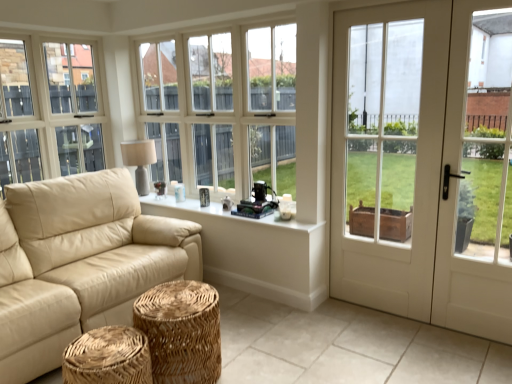
Describe the element at coordinates (425, 163) in the screenshot. I see `white glossy door at right` at that location.

What is the approximate width of white matte window sill at center, placed as the 1th window sill when sorted from bottom to top?

0.73 inches.

Locate an element on the screen. white painted wood at center, acting as the 1th window sill starting from the top is located at coordinates pos(216,213).

The image size is (512, 384). I want to click on white glossy door at right, so click(x=425, y=163).

Is there a large distance between woven natural stool at lower center, which ranks as the 2th stool in back-to-front order, and beige leather couch at left?

No, woven natural stool at lower center, which ranks as the 2th stool in back-to-front order, is not far from beige leather couch at left.

Considering the positions of objects woven natural stool at lower center, the first stool viewed from the front, and beige leather couch at left in the image provided, who is behind, woven natural stool at lower center, the first stool viewed from the front, or beige leather couch at left?

beige leather couch at left is more distant.

How many degrees apart are the facing directions of woven natural stool at lower center, which ranks as the 2th stool in back-to-front order, and beige leather couch at left?

1.86 degrees separate the facing orientations of woven natural stool at lower center, which ranks as the 2th stool in back-to-front order, and beige leather couch at left.

Is woven natural stool at lower center, the first stool viewed from the front, outside of beige leather couch at left?

Yes, woven natural stool at lower center, the first stool viewed from the front, is outside of beige leather couch at left.

Are woven natural stool at center, placed as the second stool when sorted from front to back, and woven natural stool at lower center, which ranks as the 2th stool in back-to-front order, located far from each other?

No, woven natural stool at center, placed as the second stool when sorted from front to back, is not far from woven natural stool at lower center, which ranks as the 2th stool in back-to-front order.

Which of these two, woven natural stool at center, placed as the second stool when sorted from front to back, or woven natural stool at lower center, which ranks as the 2th stool in back-to-front order, is bigger?

With larger size is woven natural stool at center, placed as the second stool when sorted from front to back.

Is woven natural stool at center, which is the first stool in back-to-front order, looking in the opposite direction of woven natural stool at lower center, which ranks as the 2th stool in back-to-front order?

woven natural stool at center, which is the first stool in back-to-front order, does not have its back to woven natural stool at lower center, which ranks as the 2th stool in back-to-front order.

Is point (151, 339) closer to camera compared to point (132, 378)?

That is False.

Between point (489, 81) and point (152, 380), which one is positioned behind?

The point (489, 81) is farther.

Is white glass door at right placed right next to woven natural stool at lower center, the first stool viewed from the front?

No, white glass door at right is not touching woven natural stool at lower center, the first stool viewed from the front.

Is white glass door at right thinner than woven natural stool at lower center, the first stool viewed from the front?

Correct, the width of white glass door at right is less than that of woven natural stool at lower center, the first stool viewed from the front.

Are matte beige lampshade at upper left and white glossy door at right located far from each other?

matte beige lampshade at upper left is positioned a significant distance from white glossy door at right.

From their relative heights in the image, would you say matte beige lampshade at upper left is taller or shorter than white glossy door at right?

Clearly, matte beige lampshade at upper left is shorter compared to white glossy door at right.

Is matte beige lampshade at upper left surrounding white glossy door at right?

Definitely not — white glossy door at right is not inside matte beige lampshade at upper left.

Is matte beige lampshade at upper left oriented towards white glossy door at right?

Yes, matte beige lampshade at upper left faces towards white glossy door at right.

Consider the image. From the image's perspective, is white wood window at center above or below white glossy door at right?

From the image's perspective, white wood window at center appears above white glossy door at right.

Which object is closer to the camera taking this photo, white wood window at center or white glossy door at right?

white glossy door at right is in front.

Is white wood window at center turned away from white glossy door at right?

No, white wood window at center's orientation is not away from white glossy door at right.

Is white painted wood at center, acting as the 1th window sill starting from the top, far away from white glossy door at right?

Indeed, white painted wood at center, acting as the 1th window sill starting from the top, is not near white glossy door at right.

From the image's perspective, between white painted wood at center, acting as the 1th window sill starting from the top, and white glossy door at right, which one is located above?

white glossy door at right appears higher in the image.

Is white painted wood at center, acting as the second window sill starting from the bottom, taller than white glossy door at right?

In fact, white painted wood at center, acting as the second window sill starting from the bottom, may be shorter than white glossy door at right.

In terms of width, does white painted wood at center, acting as the 1th window sill starting from the top, look wider or thinner when compared to white glossy door at right?

In the image, white painted wood at center, acting as the 1th window sill starting from the top, appears to be wider than white glossy door at right.

Considering the positions of objects woven natural stool at center, placed as the second stool when sorted from front to back, and white wood window at center in the image provided, who is more to the left, woven natural stool at center, placed as the second stool when sorted from front to back, or white wood window at center?

Positioned to the left is white wood window at center.

Does woven natural stool at center, placed as the second stool when sorted from front to back, have a lesser width compared to white wood window at center?

No, woven natural stool at center, placed as the second stool when sorted from front to back, is not thinner than white wood window at center.

From a real-world perspective, relative to white wood window at center, is woven natural stool at center, placed as the second stool when sorted from front to back, vertically above or below?

Clearly, from a real-world perspective, woven natural stool at center, placed as the second stool when sorted from front to back, is below white wood window at center.

From a real-world perspective, count 2nd stools downward from the beige leather couch at left and point to it. Please provide its 2D coordinates.

[(108, 357)]

At what (x,y) coordinates should I click in order to perform the action: click on stool lying above the woven natural stool at lower center, the first stool viewed from the front (from the image's perspective). Please return your answer as a coordinate pair (x, y). Looking at the image, I should click on (181, 331).

From the image, which object appears to be farther from beige leather couch at left, woven natural stool at center, placed as the second stool when sorted from front to back, or matte beige lampshade at upper left?

The object further to beige leather couch at left is matte beige lampshade at upper left.

Estimate the real-world distances between objects in this image. Which object is closer to beige leather couch at left, woven natural stool at center, placed as the second stool when sorted from front to back, or white glossy door at right?

Based on the image, woven natural stool at center, placed as the second stool when sorted from front to back, appears to be nearer to beige leather couch at left.

Looking at the image, which one is located further to white matte window sill at center, placed as the 1th window sill when sorted from bottom to top, white painted wood at center, acting as the second window sill starting from the bottom, or woven natural stool at center, which is the first stool in back-to-front order?

woven natural stool at center, which is the first stool in back-to-front order, is further to white matte window sill at center, placed as the 1th window sill when sorted from bottom to top.

Which object lies nearer to the anchor point white glass door at right, white matte window sill at center, placed as the 1th window sill when sorted from bottom to top, or white painted wood at center, acting as the second window sill starting from the bottom?

white matte window sill at center, placed as the 1th window sill when sorted from bottom to top, is closer to white glass door at right.

Which object lies further to the anchor point matte beige lampshade at upper left, white glass door at right or beige leather couch at left?

white glass door at right is positioned further to the anchor matte beige lampshade at upper left.

Considering their positions, is white wood window at center positioned closer to woven natural stool at center, placed as the second stool when sorted from front to back, than white glossy door at right?

white glossy door at right lies closer to woven natural stool at center, placed as the second stool when sorted from front to back, than the other object.

From the image, which object appears to be nearer to matte beige lampshade at upper left, woven natural stool at center, which is the first stool in back-to-front order, or beige leather couch at left?

The object closer to matte beige lampshade at upper left is beige leather couch at left.

From the image, which object appears to be farther from woven natural stool at center, placed as the second stool when sorted from front to back, beige leather couch at left or white painted wood at center, acting as the 1th window sill starting from the top?

The object further to woven natural stool at center, placed as the second stool when sorted from front to back, is white painted wood at center, acting as the 1th window sill starting from the top.

Identify the location of stool situated between beige leather couch at left and woven natural stool at center, placed as the second stool when sorted from front to back, from left to right. (108, 357).

Locate an element on the screen. The image size is (512, 384). window sill between woven natural stool at center, placed as the second stool when sorted from front to back, and white matte window sill at center, acting as the 2th window sill starting from the top, in the front-back direction is located at coordinates (216, 213).

The image size is (512, 384). In order to click on studio couch that lies between white wood window at center and white matte window sill at center, acting as the 2th window sill starting from the top, from top to bottom in this screenshot , I will do `click(79, 263)`.

Image resolution: width=512 pixels, height=384 pixels. In order to click on stool situated between woven natural stool at lower center, which ranks as the 2th stool in back-to-front order, and white glass door at right from left to right in this screenshot , I will do `click(181, 331)`.